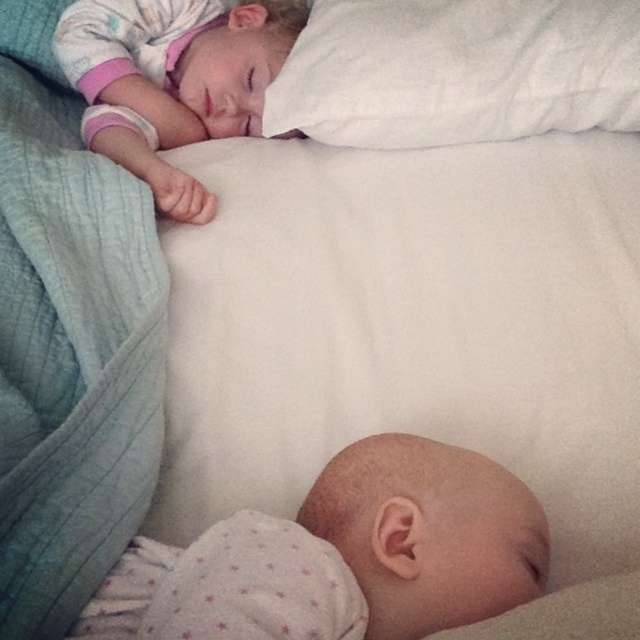
You are a photographer trying to capture a closeup of the white soft baby at upper left. You are currently positioned at point (x=342, y=556). Which direction should you move to get a better shot?

The white soft baby at upper left is located at point (x=342, y=556), so you are already at the correct position to capture the closeup.